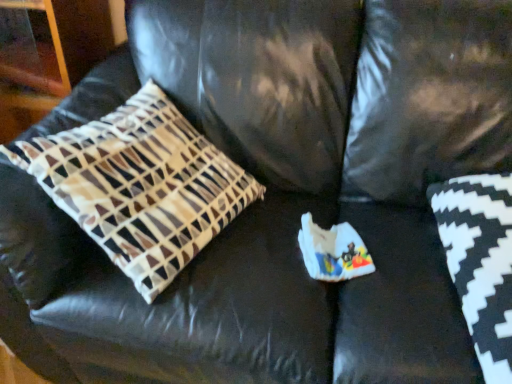
Question: From the image's perspective, is patterned fabric pillow at left, which appears as the 1th pillow when viewed from the left, on black and white zigzag pillow at lower right, which ranks as the 1th pillow in right-to-left order?

Choices:
 (A) no
 (B) yes

Answer: (B)

Question: Is patterned fabric pillow at left, which appears as the 1th pillow when viewed from the left, positioned beyond the bounds of black and white zigzag pillow at lower right, which ranks as the 1th pillow in right-to-left order?

Choices:
 (A) yes
 (B) no

Answer: (A)

Question: Does patterned fabric pillow at left, which appears as the 1th pillow when viewed from the left, have a smaller size compared to black and white zigzag pillow at lower right, which is the 2th pillow in left-to-right order?

Choices:
 (A) no
 (B) yes

Answer: (A)

Question: Is patterned fabric pillow at left, marked as the second pillow in a right-to-left arrangement, bigger than black and white zigzag pillow at lower right, which is the 2th pillow in left-to-right order?

Choices:
 (A) no
 (B) yes

Answer: (B)

Question: Are patterned fabric pillow at left, marked as the second pillow in a right-to-left arrangement, and black and white zigzag pillow at lower right, which ranks as the 1th pillow in right-to-left order, far apart?

Choices:
 (A) yes
 (B) no

Answer: (B)

Question: From the image's perspective, is patterned fabric pillow at left, marked as the second pillow in a right-to-left arrangement, beneath black and white zigzag pillow at lower right, which ranks as the 1th pillow in right-to-left order?

Choices:
 (A) yes
 (B) no

Answer: (B)

Question: Is patterned fabric pillow at left, which appears as the 1th pillow when viewed from the left, at the back of black and white zigzag pillow at lower right, which is the 2th pillow in left-to-right order?

Choices:
 (A) no
 (B) yes

Answer: (A)

Question: From a real-world perspective, is black and white zigzag pillow at lower right, which ranks as the 1th pillow in right-to-left order, located beneath patterned fabric pillow at left, marked as the second pillow in a right-to-left arrangement?

Choices:
 (A) no
 (B) yes

Answer: (B)

Question: Could you tell me if black and white zigzag pillow at lower right, which ranks as the 1th pillow in right-to-left order, is turned towards patterned fabric pillow at left, which appears as the 1th pillow when viewed from the left?

Choices:
 (A) yes
 (B) no

Answer: (B)

Question: Is black and white zigzag pillow at lower right, which is the 2th pillow in left-to-right order, outside patterned fabric pillow at left, which appears as the 1th pillow when viewed from the left?

Choices:
 (A) yes
 (B) no

Answer: (A)

Question: Considering the relative sizes of black and white zigzag pillow at lower right, which is the 2th pillow in left-to-right order, and patterned fabric pillow at left, marked as the second pillow in a right-to-left arrangement, in the image provided, is black and white zigzag pillow at lower right, which is the 2th pillow in left-to-right order, wider than patterned fabric pillow at left, marked as the second pillow in a right-to-left arrangement,?

Choices:
 (A) no
 (B) yes

Answer: (B)

Question: From the image's perspective, is black and white zigzag pillow at lower right, which ranks as the 1th pillow in right-to-left order, on top of patterned fabric pillow at left, which appears as the 1th pillow when viewed from the left?

Choices:
 (A) yes
 (B) no

Answer: (B)

Question: From the image's perspective, relative to patterned fabric pillow at left, which appears as the 1th pillow when viewed from the left, is black and white zigzag pillow at lower right, which ranks as the 1th pillow in right-to-left order, above or below?

Choices:
 (A) above
 (B) below

Answer: (B)